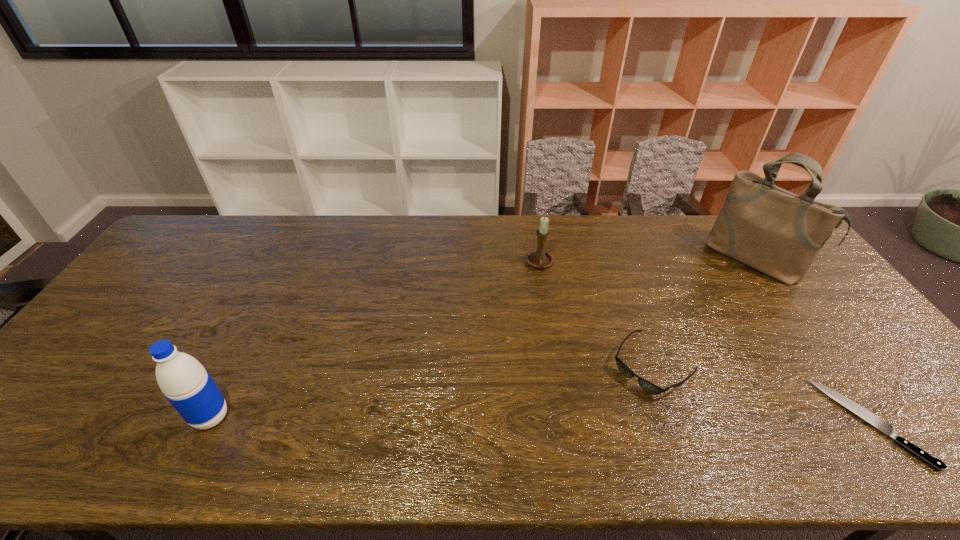
Image resolution: width=960 pixels, height=540 pixels. In order to click on free spot on the desktop that is between the water bottle and the steak knife and is positioned on the front-facing side of the second shortest object in this screenshot , I will do `click(597, 420)`.

Find the location of a particular element. Image resolution: width=960 pixels, height=540 pixels. free space on the desktop that is between the water bottle and the steak knife and is positioned on the side of the candle holder with the handle is located at coordinates (504, 420).

This screenshot has height=540, width=960. I want to click on vacant space on the desktop that is between the second tallest object and the steak knife and is positioned on the front-facing side of the shoulder bag, so click(612, 420).